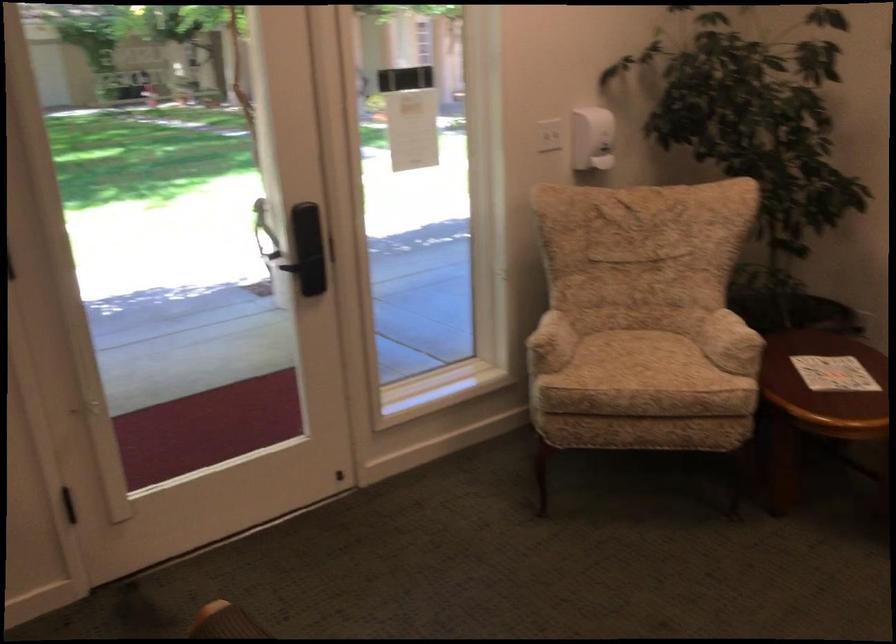
Find the location of `white light switch`. white light switch is located at coordinates (532, 142).